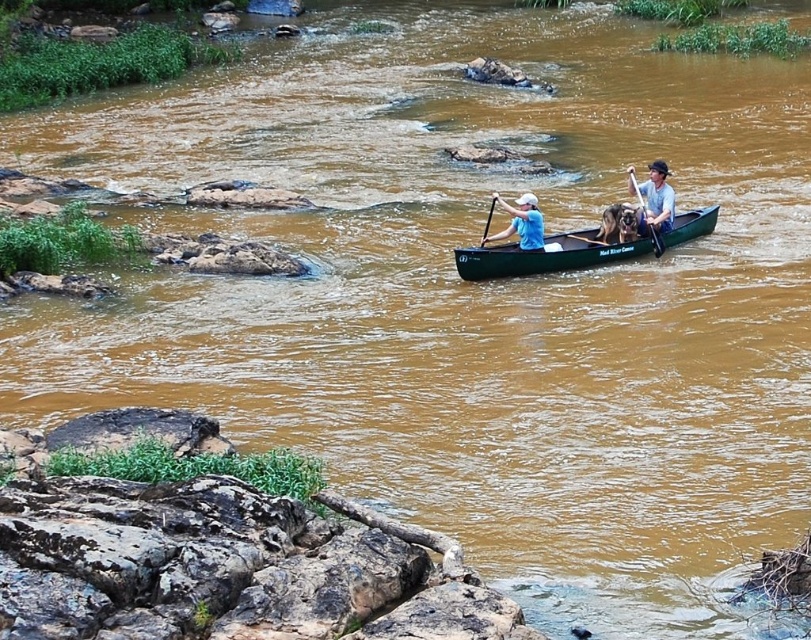
Looking at this image, you are a photographer trying to capture the green plastic canoe at center in your shot. You notice a point marked at coordinates (546, 256). Where is this point located in relation to the green plastic canoe at center?

The point at coordinates (546, 256) marks the exact location of the green plastic canoe at center.

You are a photographer standing on the riverbank. You want to take a photo of the green plastic canoe at center and the wooden paddle at right. Which object will appear larger in your photo?

The green plastic canoe at center will appear larger in the photo because it is much taller than the wooden paddle at right.

You are planning to store a black plastic paddle at center in the green plastic canoe at center. Based on their sizes, will the paddle fit inside the canoe?

The green plastic canoe at center is wider than the black plastic paddle at center, so the paddle will fit inside the canoe.